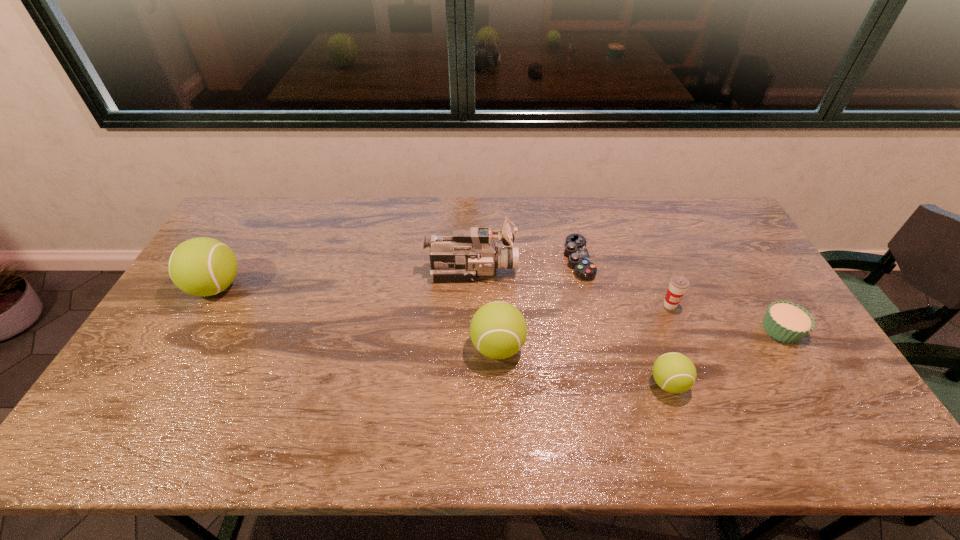
Please mark a free spot for a new tennis_ball to balance the arrangement. Please provide its 2D coordinates. Your answer should be formatted as a tuple, i.e. [(x, y)], where the tuple contains the x and y coordinates of a point satisfying the conditions above.

[(348, 315)]